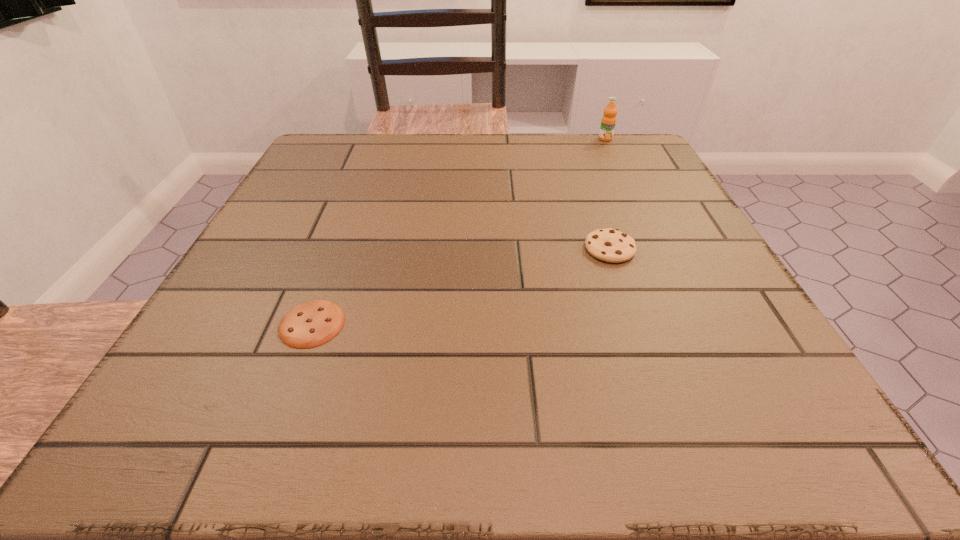
The height and width of the screenshot is (540, 960). In order to click on orange juice in this screenshot , I will do click(x=608, y=122).

Image resolution: width=960 pixels, height=540 pixels. Identify the location of the rightmost object. (608, 122).

I want to click on the right cookie, so click(x=610, y=245).

Locate an element on the screen. This screenshot has width=960, height=540. the second object from right to left is located at coordinates (610, 245).

This screenshot has height=540, width=960. I want to click on the left cookie, so click(x=310, y=324).

Locate an element on the screen. the shorter cookie is located at coordinates (310, 324).

You are a GUI agent. You are given a task and a screenshot of the screen. Output one action in this format:
    pyautogui.click(x=<x>, y=<y>)
    Task: Click on the blank space located 0.150m on the label of the farthest object
    Image resolution: width=960 pixels, height=540 pixels.
    Given the screenshot: What is the action you would take?
    pyautogui.click(x=620, y=170)

Identify the location of blank space located on the front of the second tallest object. (627, 296).

Locate an element on the screen. The width and height of the screenshot is (960, 540). free spot located 0.130m on the back of the nearest object is located at coordinates (340, 251).

You are a GUI agent. You are given a task and a screenshot of the screen. Output one action in this format:
    pyautogui.click(x=<x>, y=<y>)
    Task: Click on the object situated at the far edge
    The height and width of the screenshot is (540, 960).
    Given the screenshot: What is the action you would take?
    pyautogui.click(x=608, y=122)